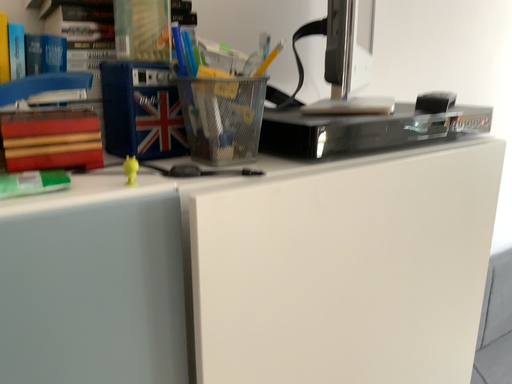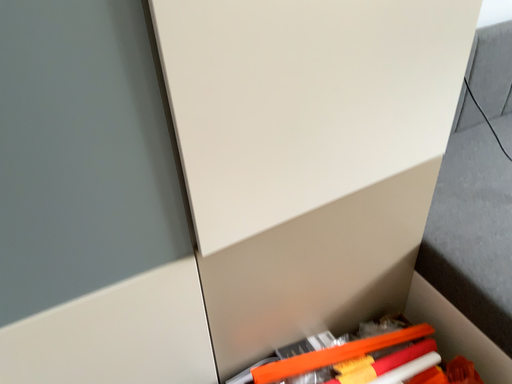
Question: How did the camera likely rotate when shooting the video?

Choices:
 (A) rotated upward
 (B) rotated downward

Answer: (B)